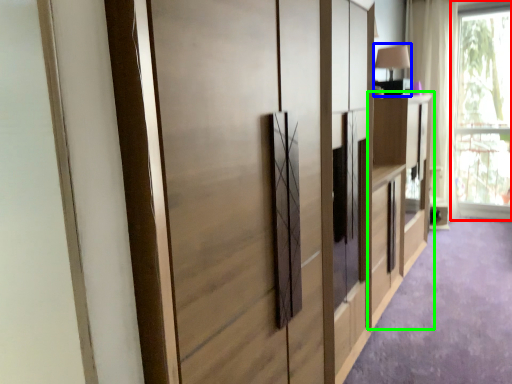
Question: Which object is the farthest from window (highlighted by a red box)? Choose among these: table lamp (highlighted by a blue box) or cabinetry (highlighted by a green box).

Choices:
 (A) table lamp
 (B) cabinetry

Answer: (A)